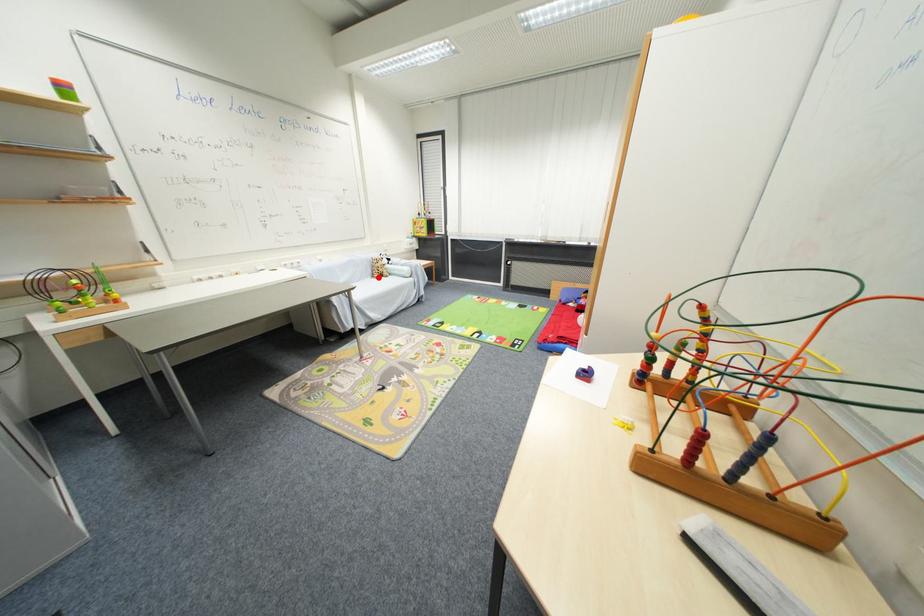
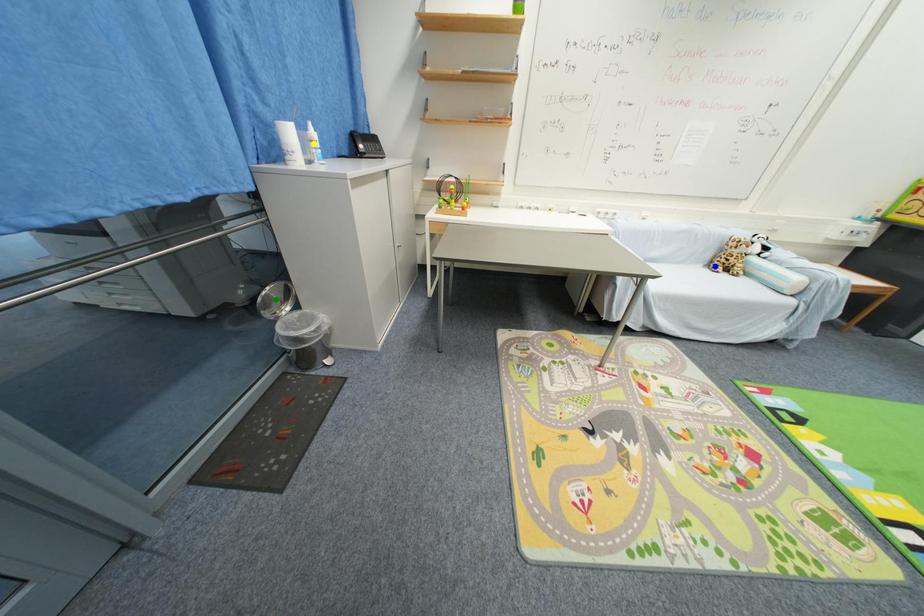
Question: I am providing you with two images of the same scene from different viewpoints. A red point is marked on the first image. You are given multiple points on the second image. Which point in image 2 is actually the same real-world point as the red point in image 1?

Choices:
 (A) blue point
 (B) yellow point
 (C) green point

Answer: (A)